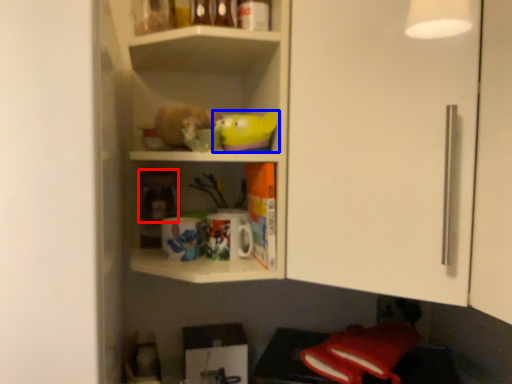
Question: Among these objects, which one is farthest to the camera, toy (highlighted by a red box) or toy (highlighted by a blue box)?

Choices:
 (A) toy
 (B) toy

Answer: (A)